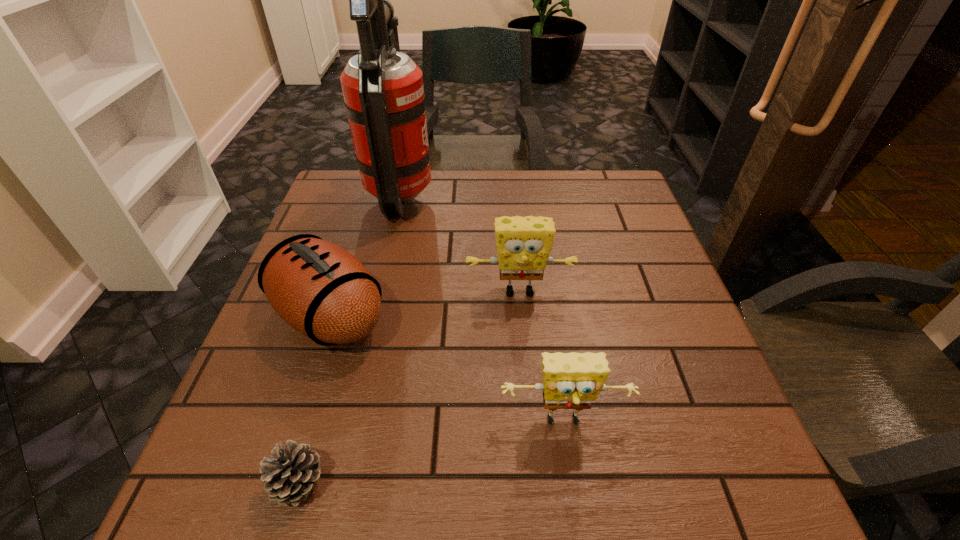
What are the coordinates of `vacant region between the shortest object and the shorter sponge` in the screenshot? It's located at (431, 453).

Image resolution: width=960 pixels, height=540 pixels. What are the coordinates of `free space between the farther sponge and the shorter sponge` in the screenshot? It's located at (541, 357).

Identify the location of empty space that is in between the shorter sponge and the tallest object. (483, 310).

Locate an element on the screen. Image resolution: width=960 pixels, height=540 pixels. free space between the fire extinguisher and the farther sponge is located at coordinates (460, 244).

I want to click on unoccupied area between the shorter sponge and the farther sponge, so click(x=541, y=357).

Identify the location of empty space that is in between the nearer sponge and the farther sponge. This screenshot has width=960, height=540. (541, 357).

The width and height of the screenshot is (960, 540). Identify the location of object that stands as the closest to the farther sponge. click(x=321, y=290).

Choose which object is the third nearest neighbor to the shortest object. Please provide its 2D coordinates. Your answer should be formatted as a tuple, i.e. [(x, y)], where the tuple contains the x and y coordinates of a point satisfying the conditions above.

[(523, 244)]

You are a GUI agent. You are given a task and a screenshot of the screen. Output one action in this format:
    pyautogui.click(x=<x>, y=<y>)
    Task: Click on the vacant area that satisfies the following two spatial constraints: 1. on the front side of the nearest object; 2. on the left side of the football (American)
    The image size is (960, 540).
    Given the screenshot: What is the action you would take?
    pyautogui.click(x=276, y=482)

Find the location of a particular element. vacant space that satisfies the following two spatial constraints: 1. on the front side of the football (American); 2. on the left side of the shortest object is located at coordinates (276, 482).